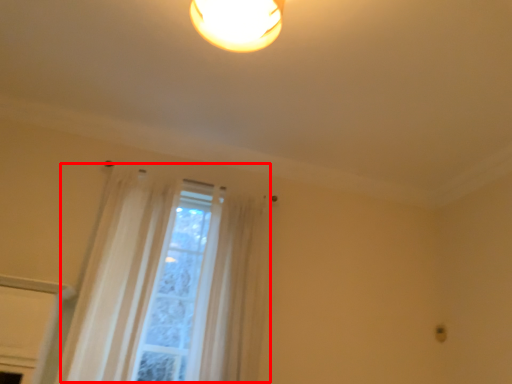
Question: In this image, where is curtain (annotated by the red box) located relative to curtain?

Choices:
 (A) right
 (B) left

Answer: (B)